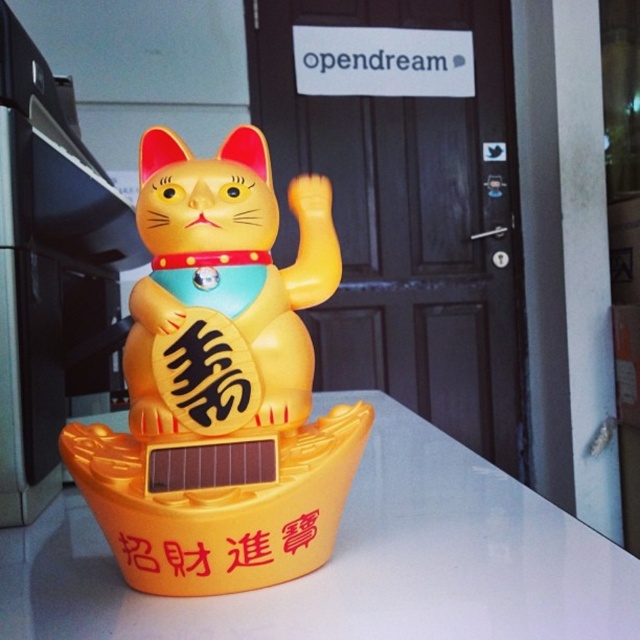
Question: Can you confirm if yellow plastic counter top at center is positioned to the left of yellow matte plastic cat at center?

Choices:
 (A) no
 (B) yes

Answer: (A)

Question: Which object is the farthest from the yellow matte text at center?

Choices:
 (A) yellow plastic cat at center
 (B) yellow matte plastic cat at center
 (C) yellow plastic counter top at center

Answer: (C)

Question: Observing the image, what is the correct spatial positioning of yellow plastic cat at center in reference to yellow plastic counter top at center?

Choices:
 (A) left
 (B) right

Answer: (A)

Question: Is yellow plastic cat at center bigger than yellow matte text at center?

Choices:
 (A) no
 (B) yes

Answer: (B)

Question: Among these objects, which one is nearest to the camera?

Choices:
 (A) yellow matte text at center
 (B) yellow plastic cat at center

Answer: (B)

Question: Which point is closer to the camera?

Choices:
 (A) (410, 550)
 (B) (317, 564)

Answer: (B)